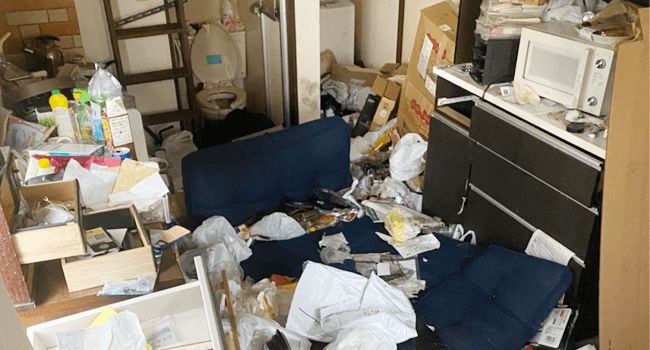
What are the coordinates of `desk that would hold several item` in the screenshot? It's located at (83, 298).